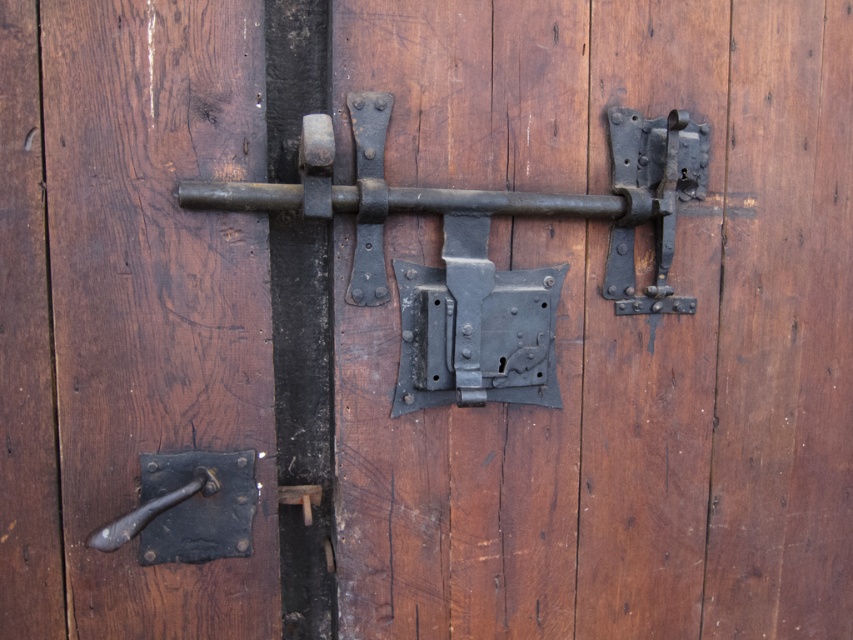
Between matte black handle at left and dark brown metal handle at lower left, which one appears on the left side from the viewer's perspective?

dark brown metal handle at lower left

What do you see at coordinates (157, 296) in the screenshot?
I see `matte black handle at left` at bounding box center [157, 296].

Which is behind, point (119, 492) or point (189, 490)?

Positioned behind is point (119, 492).

The height and width of the screenshot is (640, 853). In order to click on matte black handle at left in this screenshot , I will do `click(157, 296)`.

Between point (325, 204) and point (202, 499), which one is positioned behind?

The point (202, 499) is more distant.

Is point (660, 120) closer to viewer compared to point (206, 560)?

No.

This screenshot has height=640, width=853. I want to click on black matte metal bar at center, so click(x=498, y=198).

Image resolution: width=853 pixels, height=640 pixels. Describe the element at coordinates (157, 296) in the screenshot. I see `matte black handle at left` at that location.

Who is more distant from viewer, (177, 147) or (219, 202)?

The point (177, 147) is more distant.

The height and width of the screenshot is (640, 853). In order to click on matte black handle at left in this screenshot , I will do `click(157, 296)`.